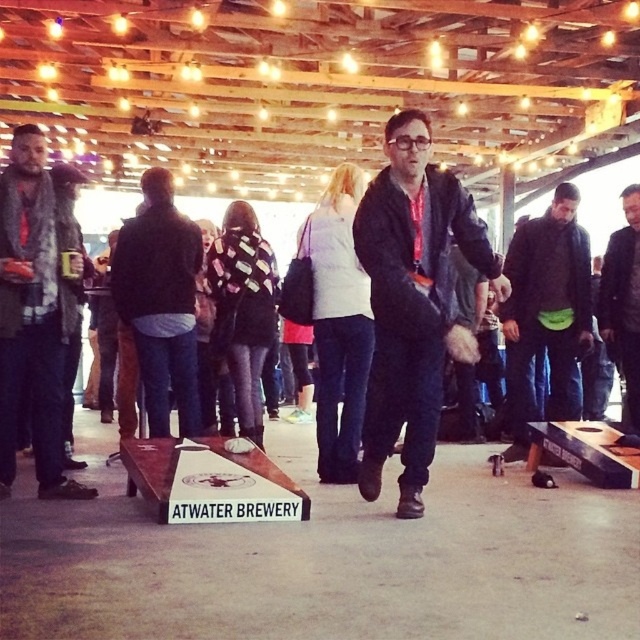
Can you confirm if black fuzzy jacket at center is positioned to the left of gray wool scarf at left?

In fact, black fuzzy jacket at center is to the right of gray wool scarf at left.

Is point (371, 276) in front of point (35, 374)?

That is True.

Which is in front, point (404, 388) or point (36, 323)?

Positioned in front is point (404, 388).

Identify the location of black fuzzy jacket at center. (413, 300).

Who is lower down, black matte jacket at center or green fabric pouch at center?

Positioned lower is green fabric pouch at center.

Where is `black matte jacket at center`? Image resolution: width=640 pixels, height=640 pixels. black matte jacket at center is located at coordinates (161, 301).

Between gray wool scarf at left and green fabric pouch at center, which one appears on the right side from the viewer's perspective?

From the viewer's perspective, green fabric pouch at center appears more on the right side.

Does gray wool scarf at left have a lesser height compared to green fabric pouch at center?

Indeed, gray wool scarf at left has a lesser height compared to green fabric pouch at center.

Does point (28, 371) come behind point (524, 381)?

No, (28, 371) is closer to viewer.

The width and height of the screenshot is (640, 640). I want to click on gray wool scarf at left, so click(33, 317).